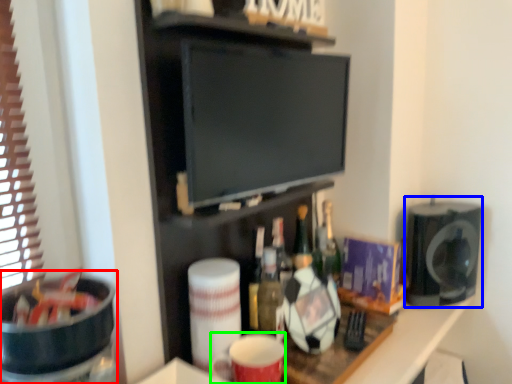
Question: Based on their relative distances, which object is nearer to appliance (highlighted by a red box)? Choose from appliance (highlighted by a blue box) and mug (highlighted by a green box).

Choices:
 (A) appliance
 (B) mug

Answer: (B)